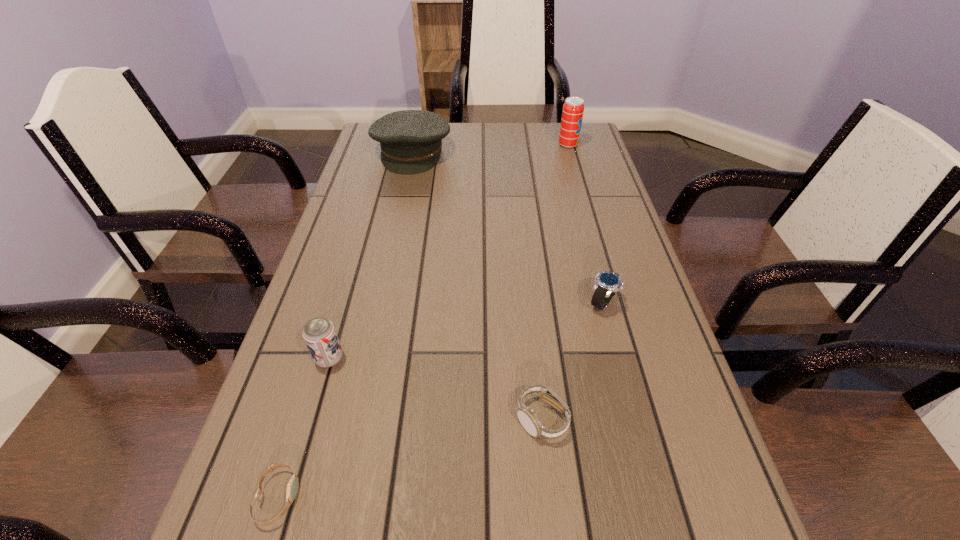
Find the location of a particular element. soda can that is at the right edge is located at coordinates (573, 109).

Where is `watch at the right edge`? watch at the right edge is located at coordinates (607, 283).

At what (x,y) coordinates should I click in order to perform the action: click on object situated at the far left corner. Please return your answer as a coordinate pair (x, y). This screenshot has width=960, height=540. Looking at the image, I should click on (411, 140).

Where is `object located in the far right corner section of the desktop`? This screenshot has height=540, width=960. object located in the far right corner section of the desktop is located at coordinates (573, 109).

The width and height of the screenshot is (960, 540). I want to click on free space at the left edge, so click(368, 232).

Image resolution: width=960 pixels, height=540 pixels. In the image, there is a desktop. Identify the location of free space at the right edge. (690, 418).

Locate an element on the screen. free space at the far right corner of the desktop is located at coordinates (585, 157).

The height and width of the screenshot is (540, 960). Find the location of `free space between the beer can and the fourth nearest object`. free space between the beer can and the fourth nearest object is located at coordinates (466, 330).

At what (x,y) coordinates should I click in order to perform the action: click on empty space between the beer can and the beret. Please return your answer as a coordinate pair (x, y). This screenshot has width=960, height=540. Looking at the image, I should click on (371, 255).

Where is `vacant area that lies between the beer can and the tallest object`? vacant area that lies between the beer can and the tallest object is located at coordinates (448, 252).